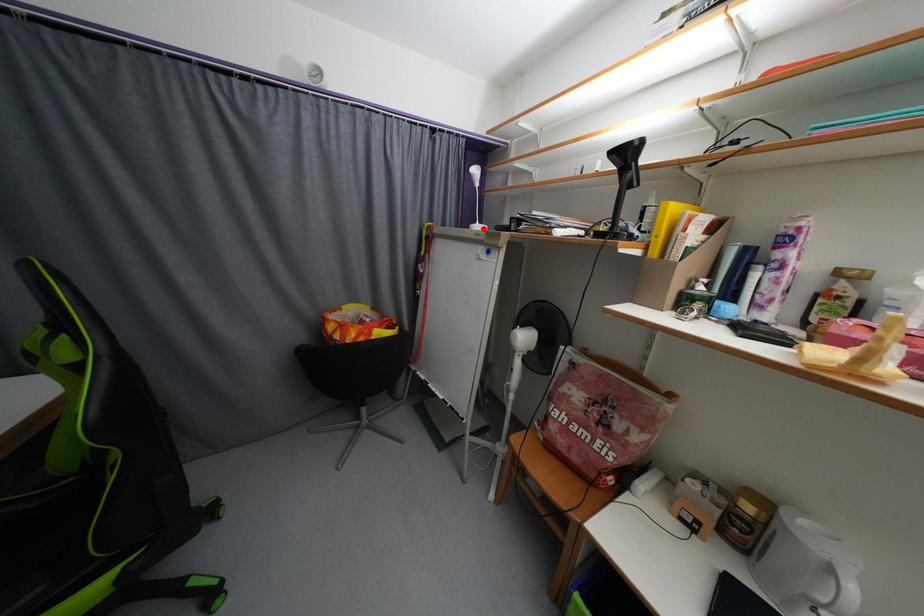
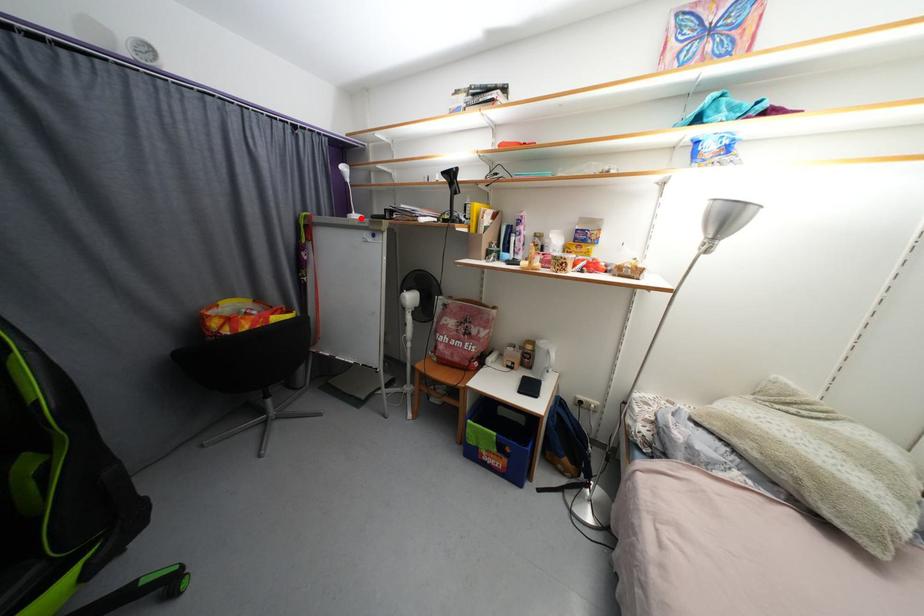
I am providing you with two images of the same scene from different viewpoints. A red point is marked on the first image and another point is marked on the second image. Do the highlighted points in image1 and image2 indicate the same real-world spot?

Yes